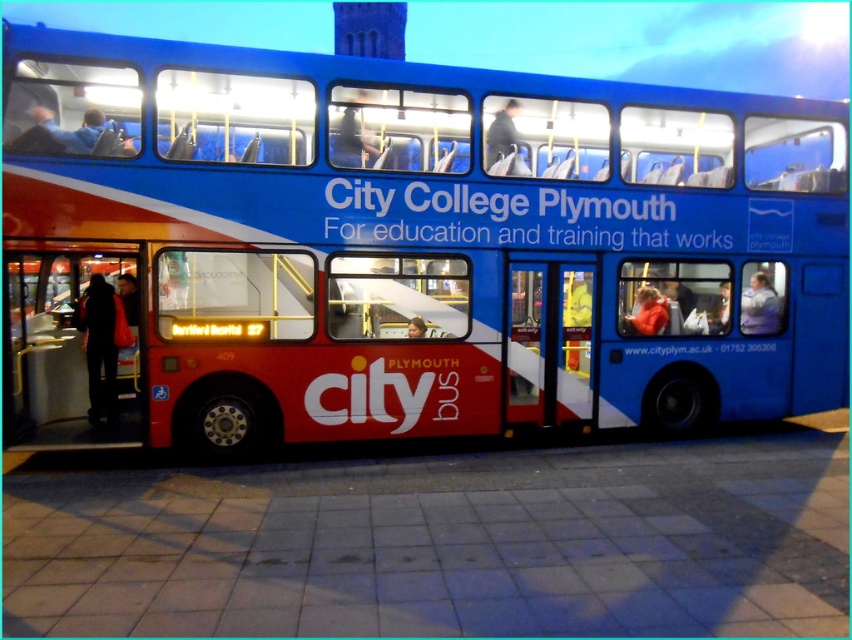
Question: Where is blue matte bus at center located in relation to metallic red bus stop at left in the image?

Choices:
 (A) left
 (B) right

Answer: (B)

Question: Can you confirm if blue matte bus at center is smaller than metallic red bus stop at left?

Choices:
 (A) yes
 (B) no

Answer: (B)

Question: Can you confirm if blue matte bus at center is wider than metallic red bus stop at left?

Choices:
 (A) yes
 (B) no

Answer: (A)

Question: Which point is closer to the camera?

Choices:
 (A) metallic red bus stop at left
 (B) blue matte bus at center

Answer: (B)

Question: Which object appears closest to the camera in this image?

Choices:
 (A) metallic red bus stop at left
 (B) blue matte bus at center

Answer: (B)

Question: Among these objects, which one is farthest from the camera?

Choices:
 (A) blue matte bus at center
 (B) metallic red bus stop at left

Answer: (B)